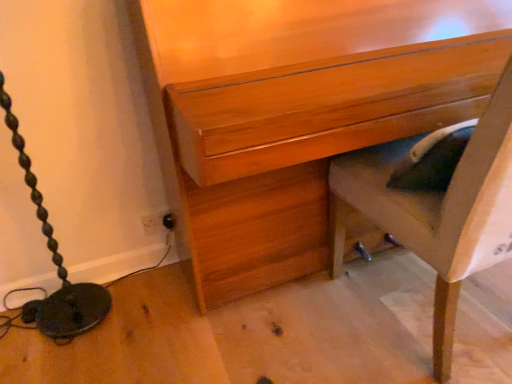
Locate an element on the screen. wooden chest of drawers at center is located at coordinates (294, 113).

What do you see at coordinates (294, 113) in the screenshot? The width and height of the screenshot is (512, 384). I see `wooden chest of drawers at center` at bounding box center [294, 113].

What do you see at coordinates (437, 211) in the screenshot? The width and height of the screenshot is (512, 384). I see `wooden chair at lower right` at bounding box center [437, 211].

This screenshot has width=512, height=384. I want to click on wooden chair at lower right, so click(437, 211).

Measure the distance between wooden chair at lower right and camera.

wooden chair at lower right is 30.04 inches away from camera.

Where is `wooden chest of drawers at center`? wooden chest of drawers at center is located at coordinates (294, 113).

Between wooden chair at lower right and wooden chest of drawers at center, which one appears on the right side from the viewer's perspective?

Positioned to the right is wooden chair at lower right.

Which object is further away from the camera, wooden chair at lower right or wooden chest of drawers at center?

wooden chest of drawers at center is behind.

Is point (462, 167) farther from camera compared to point (200, 104)?

No, it is not.

From the image's perspective, is wooden chair at lower right below wooden chest of drawers at center?

Yes, from the image's perspective, wooden chair at lower right is below wooden chest of drawers at center.

From a real-world perspective, which object stands above the other?

wooden chest of drawers at center is physically above.

Looking at their sizes, would you say wooden chair at lower right is wider or thinner than wooden chest of drawers at center?

Clearly, wooden chair at lower right has more width compared to wooden chest of drawers at center.

Is wooden chair at lower right taller or shorter than wooden chest of drawers at center?

Clearly, wooden chair at lower right is shorter compared to wooden chest of drawers at center.

Considering the relative sizes of wooden chair at lower right and wooden chest of drawers at center in the image provided, is wooden chair at lower right smaller than wooden chest of drawers at center?

Yes, wooden chair at lower right is smaller than wooden chest of drawers at center.

Would you say wooden chair at lower right is inside or outside wooden chest of drawers at center?

wooden chair at lower right exists entirely within wooden chest of drawers at center.

Consider the image. Is wooden chair at lower right not close to wooden chest of drawers at center?

They are positioned close to each other.

Is wooden chair at lower right oriented towards wooden chest of drawers at center?

Yes, wooden chair at lower right is turned towards wooden chest of drawers at center.

How many degrees apart are the facing directions of wooden chair at lower right and wooden chest of drawers at center?

177 degrees.

Measure the distance between wooden chair at lower right and wooden chest of drawers at center.

The distance of wooden chair at lower right from wooden chest of drawers at center is 11.32 inches.

The image size is (512, 384). In order to click on chest of drawers above the wooden chair at lower right (from the image's perspective) in this screenshot , I will do `click(294, 113)`.

Consider the image. Considering the relative positions of wooden chest of drawers at center and wooden chair at lower right in the image provided, is wooden chest of drawers at center to the left of wooden chair at lower right from the viewer's perspective?

Yes.

Is the position of wooden chest of drawers at center less distant than that of wooden chair at lower right?

No, the depth of wooden chest of drawers at center is greater than that of wooden chair at lower right.

Does point (451, 50) appear closer or farther from the camera than point (485, 139)?

Point (451, 50) appears to be farther away from the viewer than point (485, 139).

From the image's perspective, which is above, wooden chest of drawers at center or wooden chair at lower right?

wooden chest of drawers at center appears higher in the image.

From a real-world perspective, is wooden chest of drawers at center on top of wooden chair at lower right?

Yes, from a real-world perspective, wooden chest of drawers at center is over wooden chair at lower right

Based on the photo, considering the sizes of objects wooden chest of drawers at center and wooden chair at lower right in the image provided, who is wider, wooden chest of drawers at center or wooden chair at lower right?

Wider between the two is wooden chair at lower right.

Considering the relative sizes of wooden chest of drawers at center and wooden chair at lower right in the image provided, is wooden chest of drawers at center taller than wooden chair at lower right?

Indeed, wooden chest of drawers at center has a greater height compared to wooden chair at lower right.

From the picture: Based on their sizes in the image, would you say wooden chest of drawers at center is bigger or smaller than wooden chair at lower right?

Considering their sizes, wooden chest of drawers at center takes up more space than wooden chair at lower right.

Is wooden chest of drawers at center inside the boundaries of wooden chair at lower right, or outside?

wooden chest of drawers at center is spatially situated outside wooden chair at lower right.

Is wooden chest of drawers at center not close to wooden chair at lower right?

No, wooden chest of drawers at center is not far away from wooden chair at lower right.

Is wooden chest of drawers at center positioned with its back to wooden chair at lower right?

Yes, wooden chest of drawers at center is facing away from wooden chair at lower right.

Locate an element on the screen. This screenshot has width=512, height=384. chest of drawers on the left of wooden chair at lower right is located at coordinates (294, 113).

This screenshot has height=384, width=512. I want to click on furniture in front of the wooden chest of drawers at center, so click(437, 211).

The image size is (512, 384). Identify the location of furniture to the right of wooden chest of drawers at center. (437, 211).